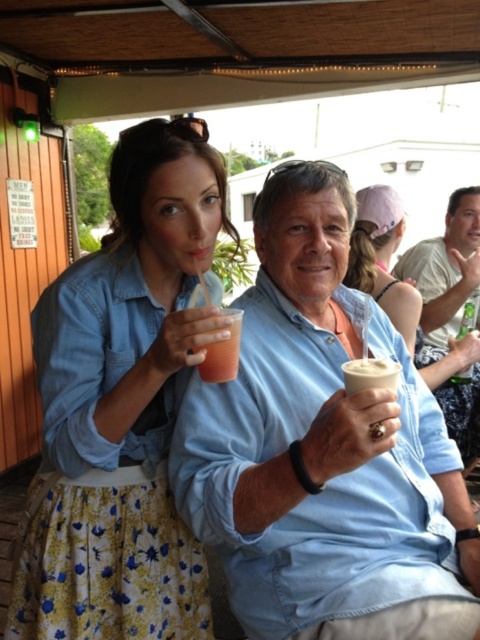
You are a photographer trying to capture a clear shot of the light blue shirt at center and the matte pink hat at upper center. Which object should you focus on first to ensure both are in focus?

You should focus on the light blue shirt at center first because it is in front of the matte pink hat at upper center, so focusing on the closer object will help both be in focus.

You are a photographer taking a photo of the floral skirt at center and the translucent plastic cup at center. Which object will appear closer to the camera in the photo?

The floral skirt at center is in front of the translucent plastic cup at center, so it will appear closer to the camera in the photo.

You are a photographer adjusting your camera settings. You want to focus on the matte pink hat at upper center and the white creamy cup at center. Which object should you adjust your focus to first if you want to capture both in sharp detail?

The matte pink hat at upper center is closer to the viewer than the white creamy cup at center, so you should focus on the matte pink hat at upper center first to ensure both are in sharp detail.